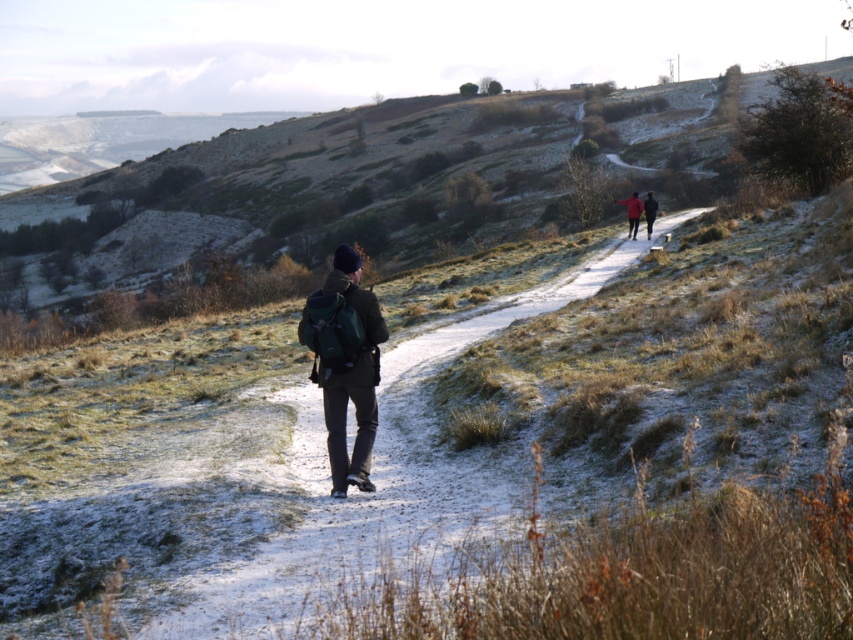
Question: Which object is the farthest from the snowy dirt path at center?

Choices:
 (A) dark green backpack at center
 (B) red fabric jacket at upper center

Answer: (B)

Question: Does snowy dirt path at center appear on the left side of red fabric jacket at upper center?

Choices:
 (A) no
 (B) yes

Answer: (B)

Question: Which object appears closest to the camera in this image?

Choices:
 (A) red fabric jacket at upper center
 (B) red woolen jacket at upper right
 (C) snowy dirt path at center
 (D) dark green backpack at center

Answer: (C)

Question: Among these points, which one is nearest to the camera?

Choices:
 (A) (654, 212)
 (B) (390, 492)
 (C) (633, 232)

Answer: (B)

Question: Is snowy dirt path at center to the right of red fabric jacket at upper center from the viewer's perspective?

Choices:
 (A) yes
 (B) no

Answer: (B)

Question: Is snowy dirt path at center bigger than red fabric jacket at upper center?

Choices:
 (A) no
 (B) yes

Answer: (B)